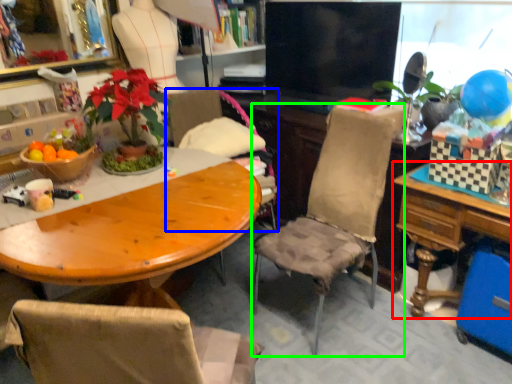
Question: Estimate the real-world distances between objects in this image. Which object is farther from table (highlighted by a red box), chair (highlighted by a blue box) or chair (highlighted by a green box)?

Choices:
 (A) chair
 (B) chair

Answer: (A)